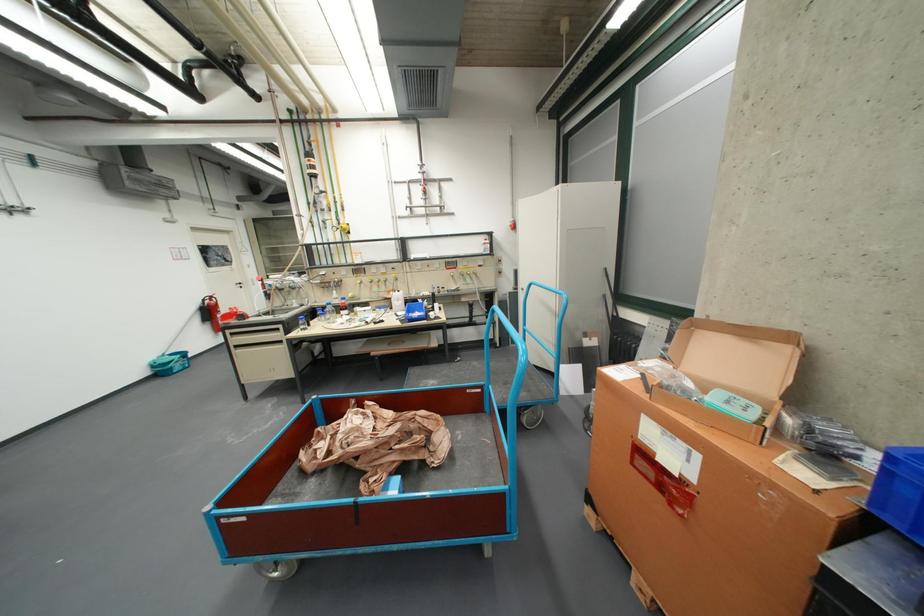
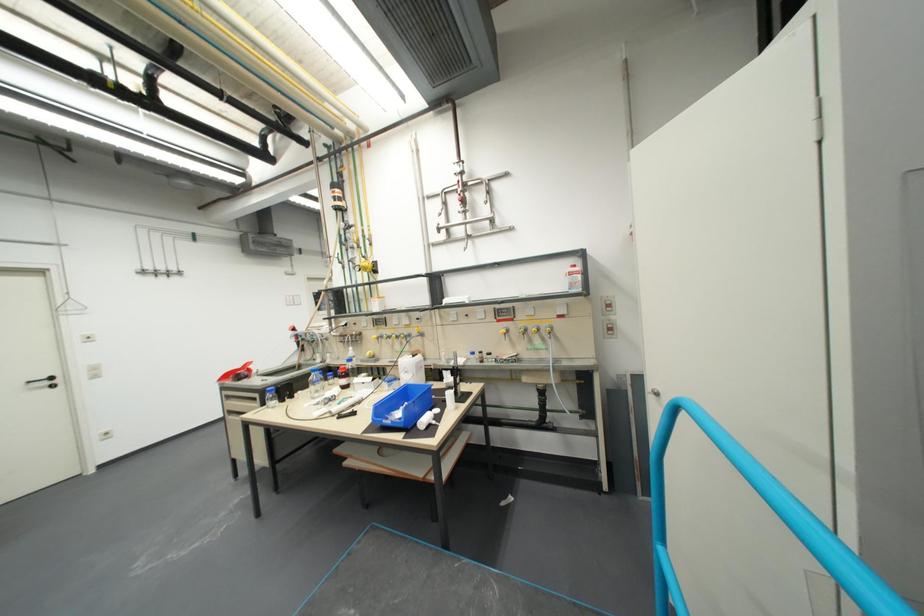
In the second image, find the point that corresponds to the point at 490,246 in the first image.

(568, 280)